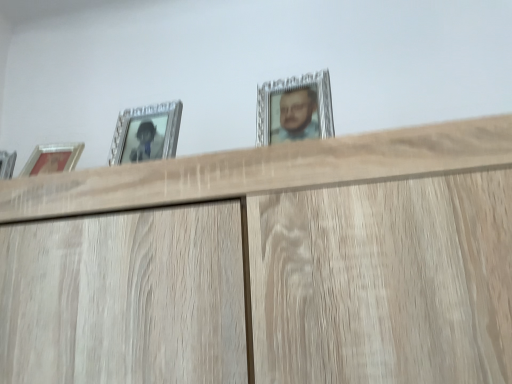
Question: From a real-world perspective, relative to silver metallic picture frame at upper center, which ranks as the 2th picture frame in left-to-right order, is silver metallic picture frame at upper left, which is counted as the 2th picture frame, starting from the right, vertically above or below?

Choices:
 (A) below
 (B) above

Answer: (A)

Question: Considering the positions of silver metallic picture frame at upper left, which is counted as the 2th picture frame, starting from the right, and silver metallic picture frame at upper center, which ranks as the 2th picture frame in left-to-right order, in the image, is silver metallic picture frame at upper left, which is counted as the 2th picture frame, starting from the right, wider or thinner than silver metallic picture frame at upper center, which ranks as the 2th picture frame in left-to-right order,?

Choices:
 (A) thin
 (B) wide

Answer: (A)

Question: Is silver metallic picture frame at upper left, which is counted as the 2th picture frame, starting from the right, taller or shorter than silver metallic picture frame at upper center, which ranks as the 2th picture frame in left-to-right order?

Choices:
 (A) tall
 (B) short

Answer: (A)

Question: From their relative heights in the image, would you say silver metallic picture frame at upper center, which is the first picture frame in right-to-left order, is taller or shorter than silver metallic picture frame at upper left, which is the 1th picture frame from left to right?

Choices:
 (A) tall
 (B) short

Answer: (B)

Question: In terms of width, does silver metallic picture frame at upper center, which ranks as the 2th picture frame in left-to-right order, look wider or thinner when compared to silver metallic picture frame at upper left, which is the 1th picture frame from left to right?

Choices:
 (A) thin
 (B) wide

Answer: (B)

Question: Considering their positions, is silver metallic picture frame at upper center, which is the first picture frame in right-to-left order, located in front of or behind silver metallic picture frame at upper left, which is counted as the 2th picture frame, starting from the right?

Choices:
 (A) front
 (B) behind

Answer: (A)

Question: Based on their positions, is silver metallic picture frame at upper center, which is the first picture frame in right-to-left order, located to the left or right of silver metallic picture frame at upper left, which is counted as the 2th picture frame, starting from the right?

Choices:
 (A) left
 (B) right

Answer: (B)